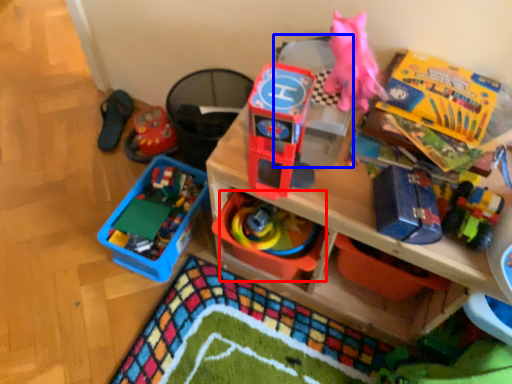
Question: Which object is closer to the camera taking this photo, toy (highlighted by a red box) or storage box (highlighted by a blue box)?

Choices:
 (A) toy
 (B) storage box

Answer: (B)